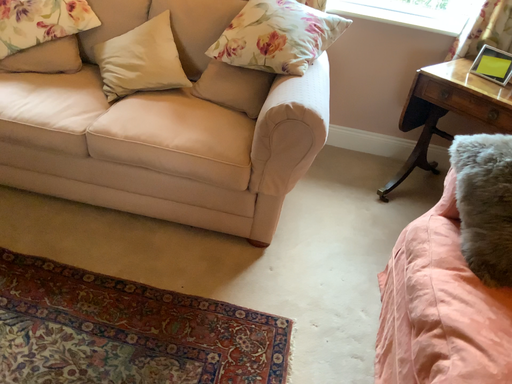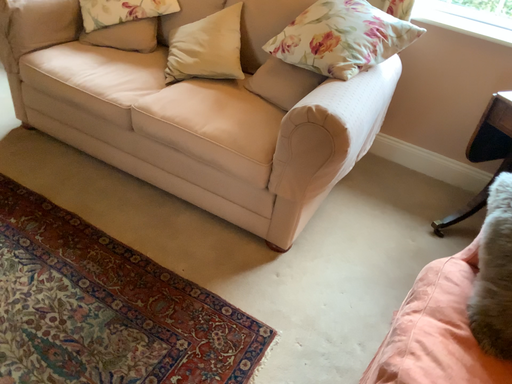
Question: How did the camera likely rotate when shooting the video?

Choices:
 (A) rotated right
 (B) rotated left

Answer: (B)